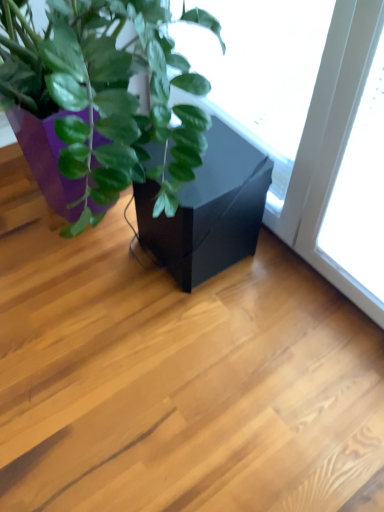
The height and width of the screenshot is (512, 384). I want to click on vacant area located to the right-hand side of black matte flowerpot at center, so click(292, 286).